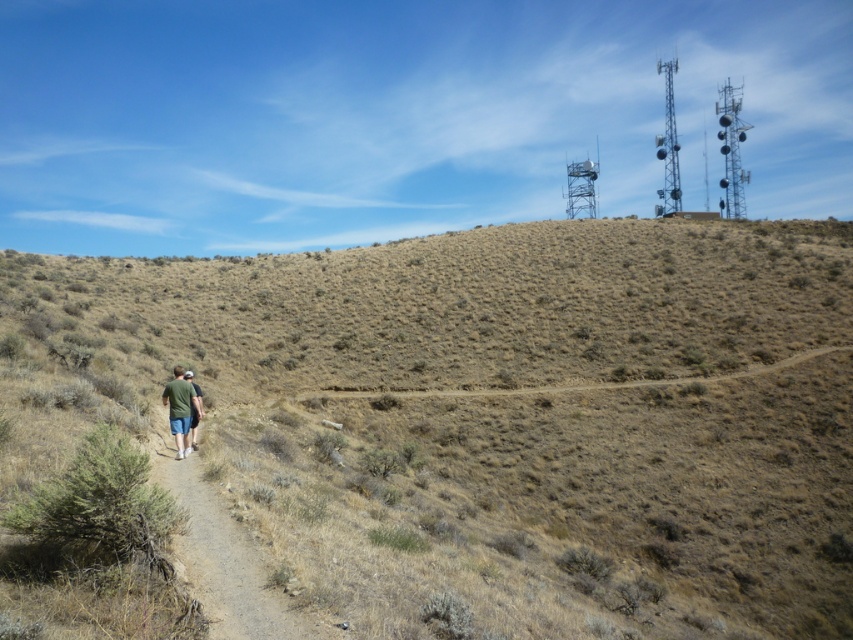
Question: Does brown dry grass at center appear on the left side of dirt path at lower left?

Choices:
 (A) yes
 (B) no

Answer: (A)

Question: Is brown dry grass at center behind dirt path at lower left?

Choices:
 (A) no
 (B) yes

Answer: (A)

Question: Which of the following is the farthest from the observer?

Choices:
 (A) green fabric shorts at lower left
 (B) dirt path at lower left
 (C) green fabric shirt at center

Answer: (C)

Question: Among these points, which one is farthest from the camera?

Choices:
 (A) (229, 269)
 (B) (195, 404)
 (C) (247, 573)
 (D) (180, 394)

Answer: (A)

Question: Which object appears farthest from the camera in this image?

Choices:
 (A) green fabric shorts at lower left
 (B) brown dry grass at center
 (C) green fabric shirt at center

Answer: (C)

Question: In this image, where is brown dry grass at center located relative to green fabric shorts at lower left?

Choices:
 (A) above
 (B) below

Answer: (A)